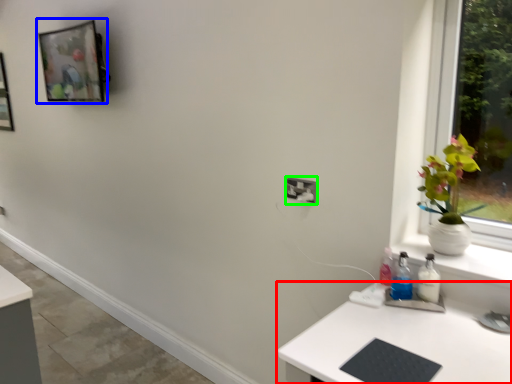
Question: Which is nearer to the desk (highlighted by a red box)? picture frame (highlighted by a blue box) or electric outlet (highlighted by a green box).

Choices:
 (A) picture frame
 (B) electric outlet

Answer: (B)